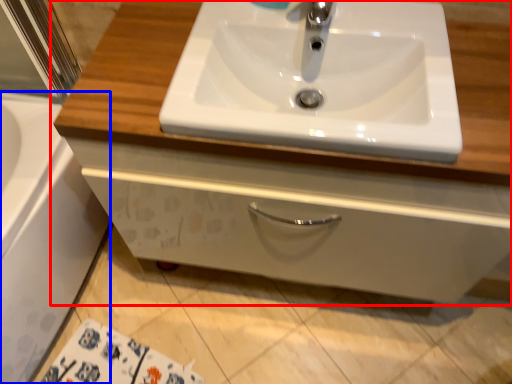
Question: Among these objects, which one is farthest to the camera, bathroom cabinet (highlighted by a red box) or bath (highlighted by a blue box)?

Choices:
 (A) bathroom cabinet
 (B) bath

Answer: (B)